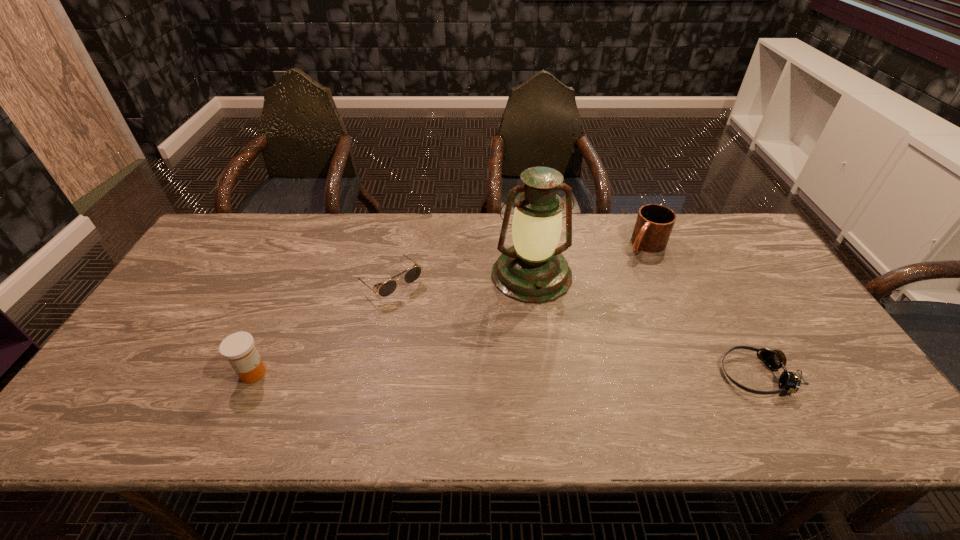
Locate an element on the screen. free space located 0.070m through the lenses of the goggles is located at coordinates (693, 375).

Identify the location of vacant area situated through the lenses of the goggles. (677, 375).

Where is `blank area located 0.090m through the lenses of the goggles`? The width and height of the screenshot is (960, 540). blank area located 0.090m through the lenses of the goggles is located at coordinates (684, 375).

Where is `blank space located 0.230m on the front lenses of the fourth tallest object`? The height and width of the screenshot is (540, 960). blank space located 0.230m on the front lenses of the fourth tallest object is located at coordinates tap(463, 349).

I want to click on free location located on the front lenses of the fourth tallest object, so click(487, 372).

Where is `vacant area located 0.390m on the front lenses of the fourth tallest object`? The image size is (960, 540). vacant area located 0.390m on the front lenses of the fourth tallest object is located at coordinates (507, 390).

Locate an element on the screen. vacant area located 0.190m with the light compartment facing forward on the lantern is located at coordinates (554, 359).

Image resolution: width=960 pixels, height=540 pixels. What are the coordinates of `vacant space situated with the light compartment facing forward on the lantern` in the screenshot? It's located at (553, 356).

Find the location of a particular element. vacant space located with the light compartment facing forward on the lantern is located at coordinates (564, 394).

The image size is (960, 540). Find the location of `free space located 0.190m on the side of the mug with the handle`. free space located 0.190m on the side of the mug with the handle is located at coordinates (605, 287).